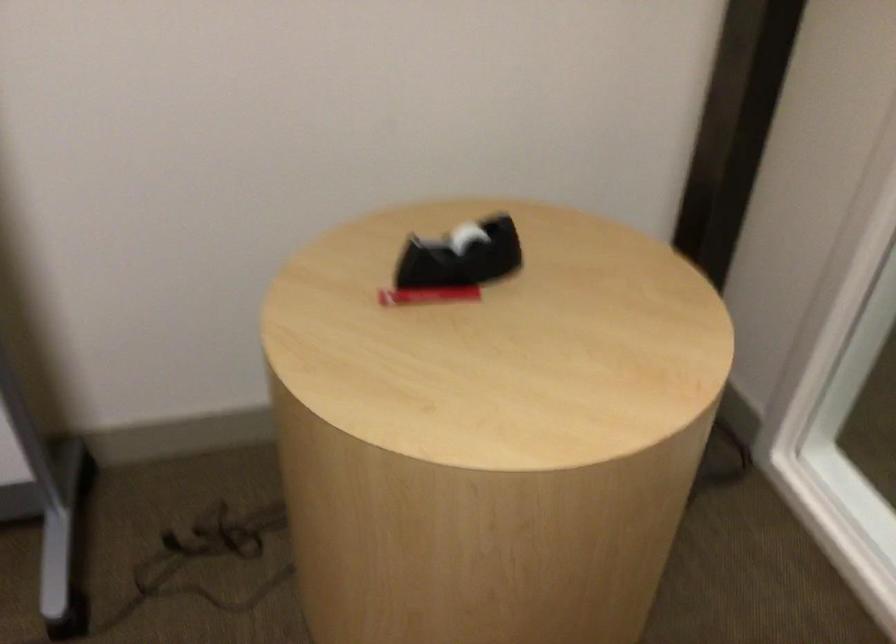
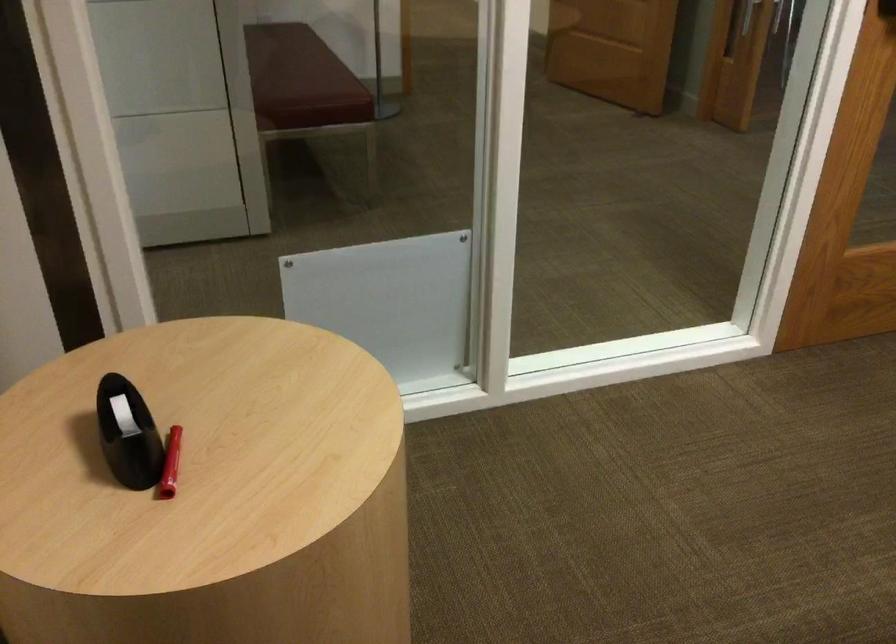
In the scene shown: Based on the continuous images, in which direction is the camera rotating?

The rotation direction of the camera is right-down.